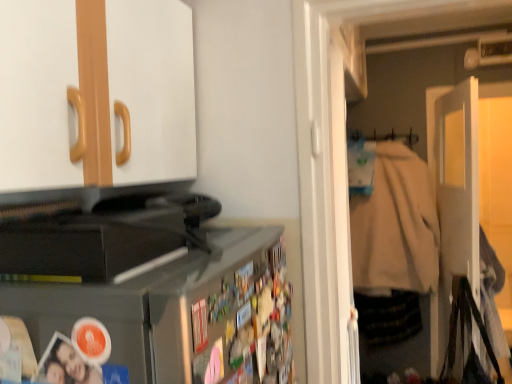
Question: Is white fabric hanger at upper right positioned far away from black plastic toaster at lower left?

Choices:
 (A) yes
 (B) no

Answer: (A)

Question: Does white fabric hanger at upper right contain black plastic toaster at lower left?

Choices:
 (A) no
 (B) yes

Answer: (A)

Question: Is white fabric hanger at upper right not inside black plastic toaster at lower left?

Choices:
 (A) yes
 (B) no

Answer: (A)

Question: From a real-world perspective, is white fabric hanger at upper right located higher than black plastic toaster at lower left?

Choices:
 (A) no
 (B) yes

Answer: (B)

Question: Can you confirm if white fabric hanger at upper right is positioned to the right of black plastic toaster at lower left?

Choices:
 (A) no
 (B) yes

Answer: (B)

Question: Looking at the image, does white fabric hanger at upper right seem bigger or smaller compared to black plastic toaster at lower left?

Choices:
 (A) big
 (B) small

Answer: (B)

Question: In the image, is white fabric hanger at upper right positioned in front of or behind black plastic toaster at lower left?

Choices:
 (A) behind
 (B) front

Answer: (A)

Question: In terms of width, does white fabric hanger at upper right look wider or thinner when compared to black plastic toaster at lower left?

Choices:
 (A) wide
 (B) thin

Answer: (B)

Question: Is white fabric hanger at upper right to the left or to the right of black plastic toaster at lower left in the image?

Choices:
 (A) right
 (B) left

Answer: (A)

Question: Is point (456, 261) closer or farther from the camera than point (32, 210)?

Choices:
 (A) farther
 (B) closer

Answer: (A)

Question: From a real-world perspective, is white matte door at right physically located above or below black plastic toaster at lower left?

Choices:
 (A) above
 (B) below

Answer: (B)

Question: From the image's perspective, is white matte door at right above or below black plastic toaster at lower left?

Choices:
 (A) above
 (B) below

Answer: (B)

Question: Considering the positions of white matte door at right and black plastic toaster at lower left in the image, is white matte door at right bigger or smaller than black plastic toaster at lower left?

Choices:
 (A) big
 (B) small

Answer: (A)

Question: Visually, is beige cotton jacket at right positioned to the left or to the right of black plastic toaster at lower left?

Choices:
 (A) left
 (B) right

Answer: (B)

Question: Relative to black plastic toaster at lower left, is beige cotton jacket at right in front or behind?

Choices:
 (A) behind
 (B) front

Answer: (A)